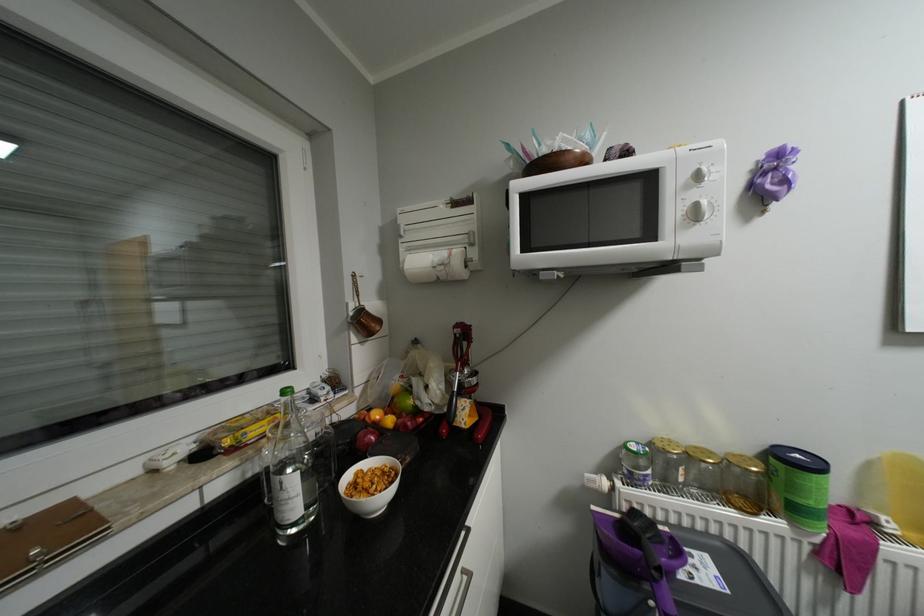
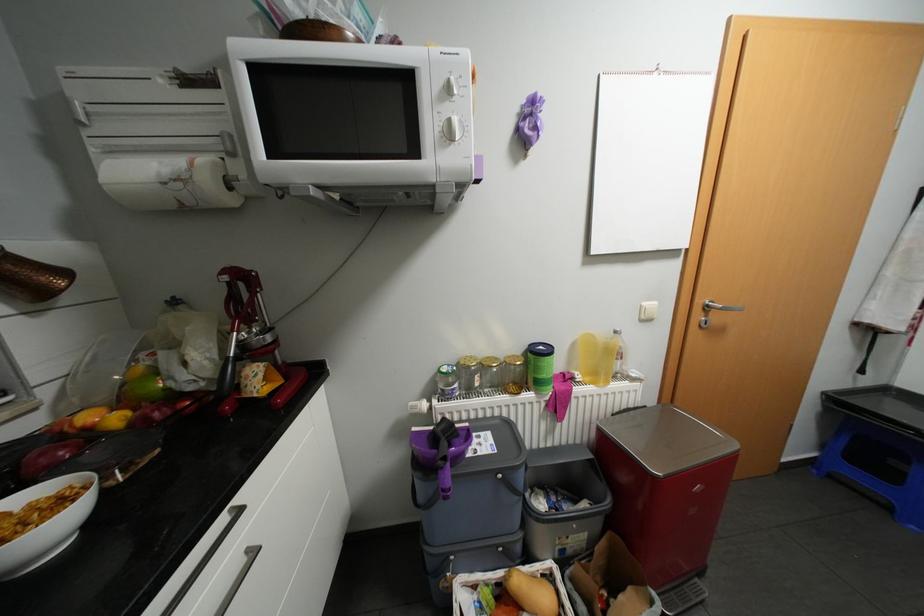
In the second image, find the point that corresponds to point 664,580 in the first image.

(450, 467)